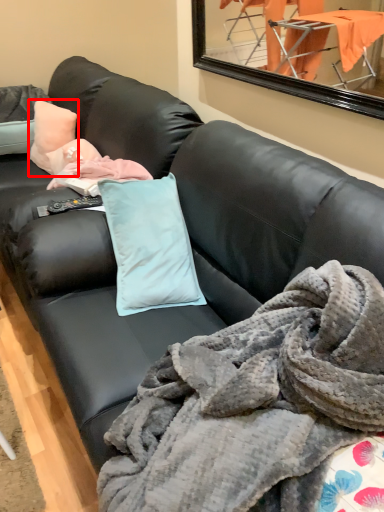
Question: Where is pillow (annotated by the red box) located in relation to blanket in the image?

Choices:
 (A) right
 (B) left

Answer: (B)